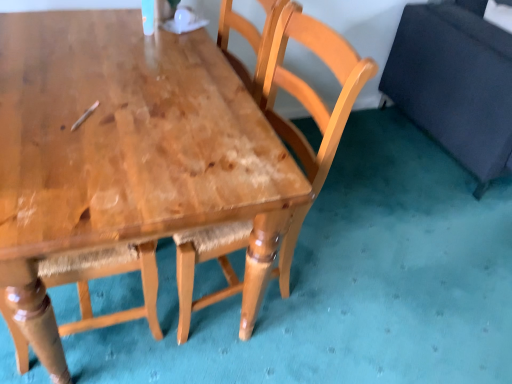
Question: From the image's perspective, is shiny brown wood table at center beneath dark blue fabric swivel chair at right?

Choices:
 (A) yes
 (B) no

Answer: (A)

Question: Is shiny brown wood table at center taller than dark blue fabric swivel chair at right?

Choices:
 (A) no
 (B) yes

Answer: (B)

Question: Does shiny brown wood table at center contain dark blue fabric swivel chair at right?

Choices:
 (A) no
 (B) yes

Answer: (A)

Question: From the image's perspective, is shiny brown wood table at center on top of dark blue fabric swivel chair at right?

Choices:
 (A) yes
 (B) no

Answer: (B)

Question: Is shiny brown wood table at center facing towards dark blue fabric swivel chair at right?

Choices:
 (A) no
 (B) yes

Answer: (B)

Question: Looking at the image, does wooden chair at center seem bigger or smaller compared to dark blue fabric swivel chair at right?

Choices:
 (A) small
 (B) big

Answer: (A)

Question: From a real-world perspective, is wooden chair at center positioned above or below dark blue fabric swivel chair at right?

Choices:
 (A) above
 (B) below

Answer: (A)

Question: In terms of height, does wooden chair at center look taller or shorter compared to dark blue fabric swivel chair at right?

Choices:
 (A) short
 (B) tall

Answer: (B)

Question: Is wooden chair at center spatially inside dark blue fabric swivel chair at right, or outside of it?

Choices:
 (A) inside
 (B) outside

Answer: (B)

Question: Is point (2, 273) closer or farther from the camera than point (476, 155)?

Choices:
 (A) closer
 (B) farther

Answer: (A)

Question: Would you say shiny brown wood table at center is to the left or to the right of dark blue fabric swivel chair at right in the picture?

Choices:
 (A) right
 (B) left

Answer: (B)

Question: Considering the positions of shiny brown wood table at center and dark blue fabric swivel chair at right in the image, is shiny brown wood table at center taller or shorter than dark blue fabric swivel chair at right?

Choices:
 (A) short
 (B) tall

Answer: (B)

Question: Choose the correct answer: Is shiny brown wood table at center inside dark blue fabric swivel chair at right or outside it?

Choices:
 (A) inside
 (B) outside

Answer: (B)

Question: From a real-world perspective, relative to wooden chair at center, is shiny brown wood table at center vertically above or below?

Choices:
 (A) below
 (B) above

Answer: (A)

Question: From their relative heights in the image, would you say shiny brown wood table at center is taller or shorter than wooden chair at center?

Choices:
 (A) short
 (B) tall

Answer: (B)